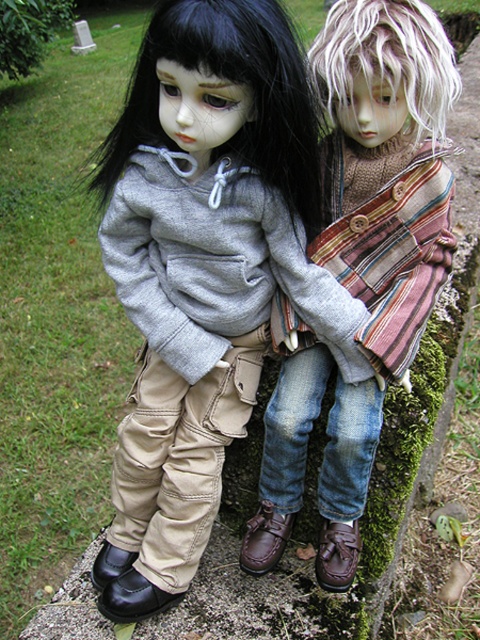
In the scene shown: You are a tailor measuring fabrics for alterations. You have a piece of fabric that is 18 inches wide. You need to decide whether it can cover either the matte gray hoodie at center or the striped woolen scarf at center. Which item can the fabric cover based on their widths?

The matte gray hoodie at center is wider than the striped woolen scarf at center. Since the fabric is 18 inches wide, it can cover the matte gray hoodie at center if its width matches or exceeds the hoodie, but not the scarf. However, without exact measurements, we can only conclude the hoodie is wider. Please verify actual dimensions.

You are a tailor who needs to determine which item requires more fabric to repair between the matte gray hoodie at center and the striped woolen scarf at center. Which one would you prioritize?

The matte gray hoodie at center is bigger than the striped woolen scarf at center, so it would require more fabric and should be prioritized.